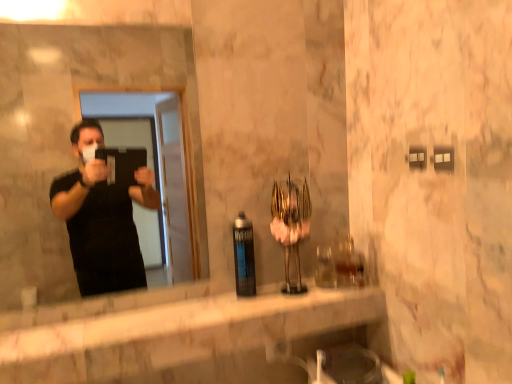
I want to click on vacant area that is situated to the right of matte black spray can at center, so click(x=296, y=297).